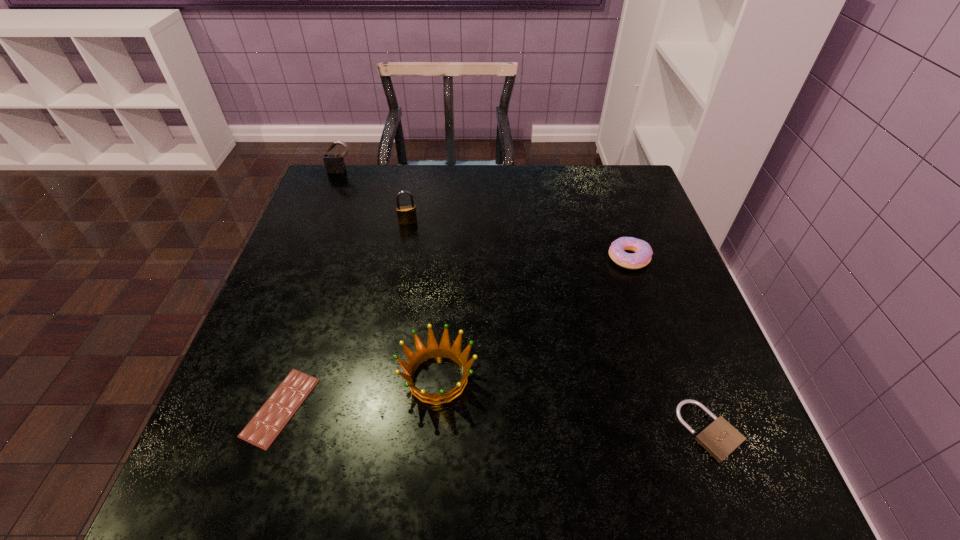
Identify the location of padlock that is positioned at the left edge. This screenshot has width=960, height=540. (334, 163).

Find the location of a particular element. The height and width of the screenshot is (540, 960). chocolate bar at the left edge is located at coordinates (265, 426).

Image resolution: width=960 pixels, height=540 pixels. Identify the location of doughnut located in the right edge section of the desktop. (643, 253).

Image resolution: width=960 pixels, height=540 pixels. Find the location of `padlock present at the right edge`. padlock present at the right edge is located at coordinates (720, 438).

Where is `object that is at the far left corner`? object that is at the far left corner is located at coordinates (334, 163).

The height and width of the screenshot is (540, 960). In order to click on object that is at the near left corner in this screenshot , I will do `click(265, 426)`.

Locate an element on the screen. The height and width of the screenshot is (540, 960). object that is positioned at the near right corner is located at coordinates (720, 438).

In the image, there is a desktop. Where is `vacant space at the far edge`? This screenshot has height=540, width=960. vacant space at the far edge is located at coordinates (459, 165).

Locate an element on the screen. free space at the left edge of the desktop is located at coordinates (323, 305).

Where is `vacant space at the right edge`? vacant space at the right edge is located at coordinates (691, 354).